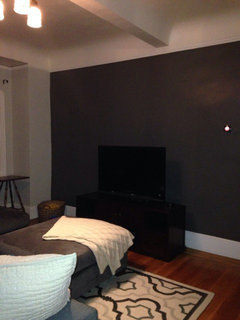
What are the coordinates of `cushion` in the screenshot? It's located at (39, 303).